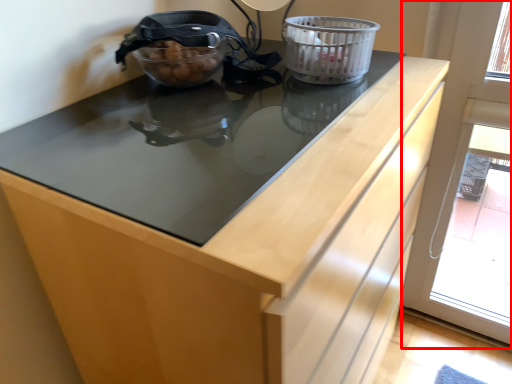
Question: From the image's perspective, what is the correct spatial relationship of screen door (annotated by the red box) in relation to basket container?

Choices:
 (A) above
 (B) below

Answer: (B)